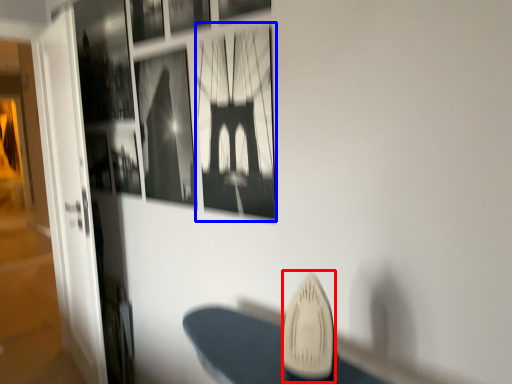
Question: Which point is further to the camera, surfboard (highlighted by a red box) or picture frame (highlighted by a blue box)?

Choices:
 (A) surfboard
 (B) picture frame

Answer: (B)